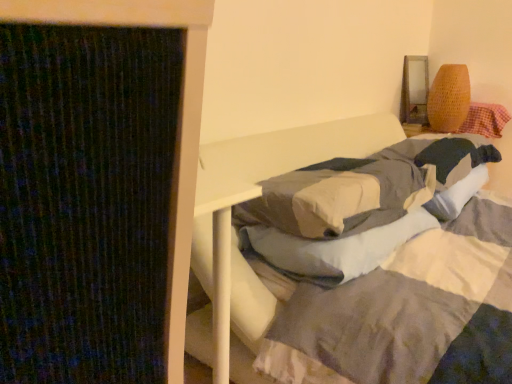
Locate an element on the screen. The height and width of the screenshot is (384, 512). brown woven vase at upper right is located at coordinates (449, 98).

What do you see at coordinates (449, 98) in the screenshot?
I see `brown woven vase at upper right` at bounding box center [449, 98].

Locate an element on the screen. brown woven vase at upper right is located at coordinates tap(449, 98).